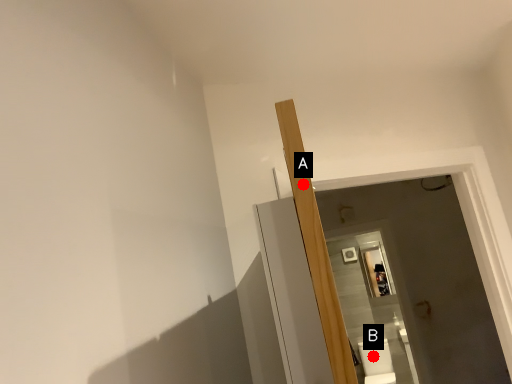
Question: Two points are circled on the image, labeled by A and B beside each circle. Which point is farther from the camera taking this photo?

Choices:
 (A) A is further
 (B) B is further

Answer: (B)